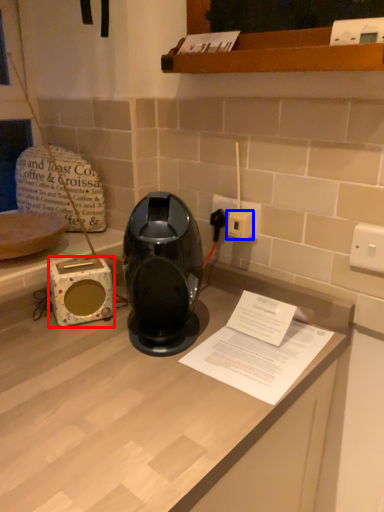
Question: Which object appears closest to the camera in this image, appliance (highlighted by a red box) or socket (highlighted by a blue box)?

Choices:
 (A) appliance
 (B) socket

Answer: (A)